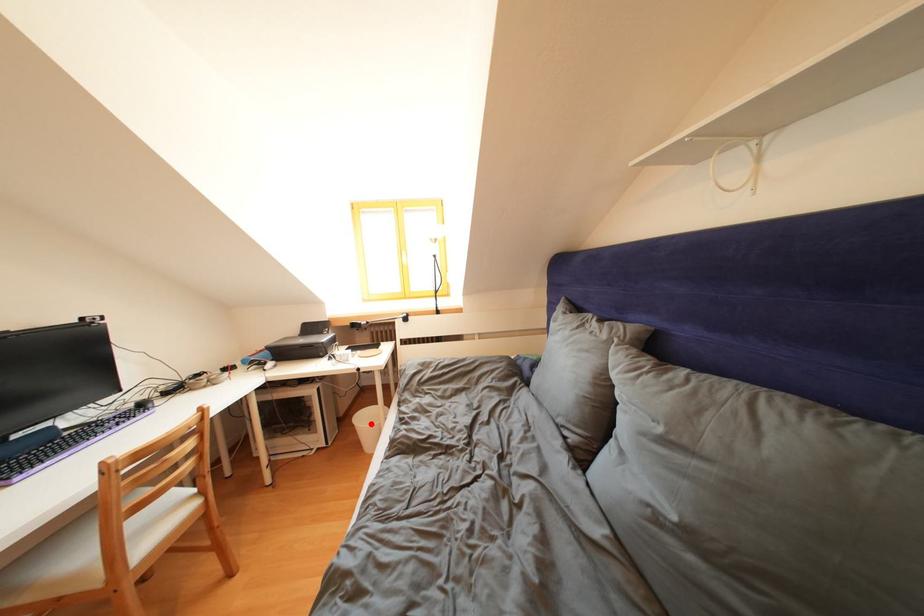
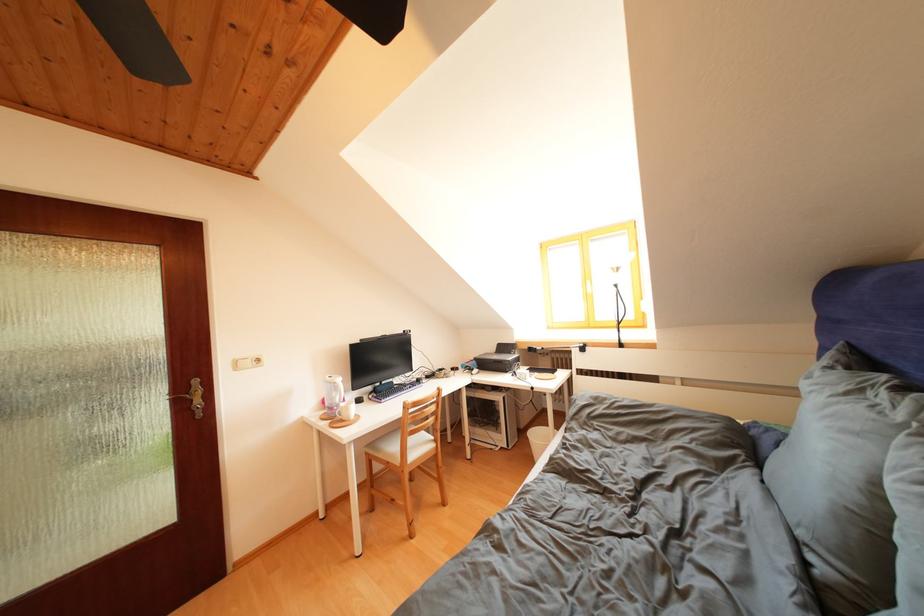
Question: I am providing you with two images of the same scene from different viewpoints. Image1 has a red point marked. In image2, the corresponding 3D location appears at what relative position? Reply with the corresponding letter.

Choices:
 (A) Closer
 (B) Farther

Answer: (B)